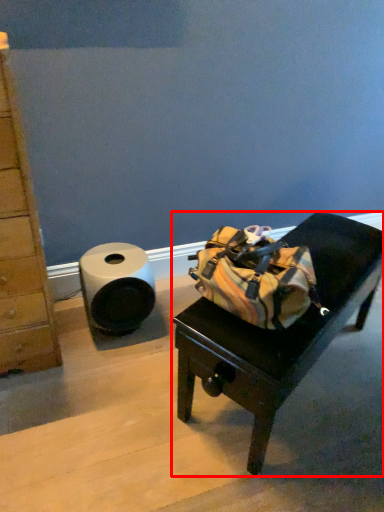
Question: In this image, where is furniture (annotated by the red box) located relative to toilet paper?

Choices:
 (A) right
 (B) left

Answer: (A)